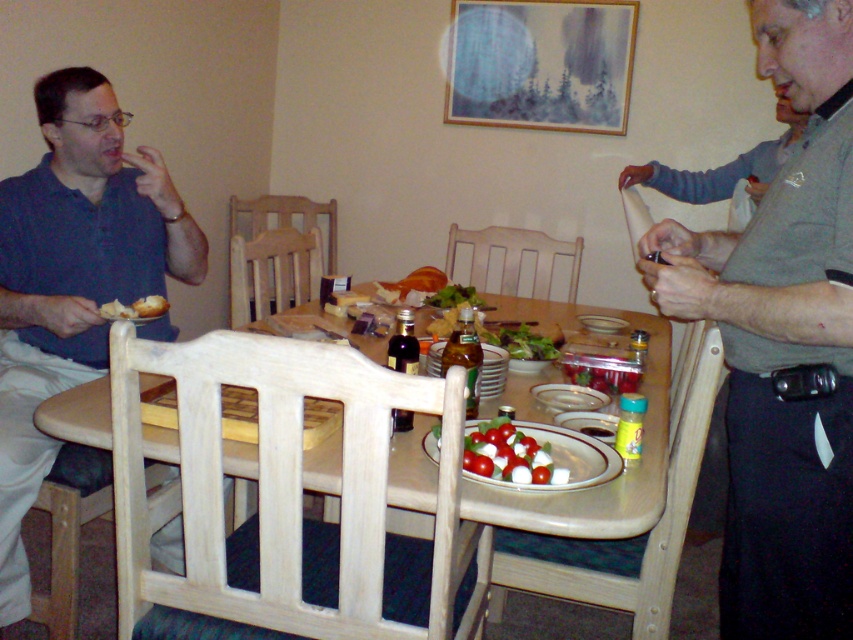
You are a guest at this dinner and want to reach the matte glass platter at center without disturbing the matte blue shirt at left. Is there enough vertical space between the two to slide your hand underneath?

The matte blue shirt at left is above the matte glass platter at center, so there is vertical space between them. You can slide your hand underneath the matte blue shirt at left to reach the matte glass platter at center.

You are a guest at this dinner and want to reach for the matte bread at left without disturbing the gray cotton shirt at right. Which direction should you move your hand to grab it?

The gray cotton shirt at right is in front of matte bread at left, so you should move your hand to the left to reach the matte bread at left while avoiding the gray cotton shirt at right.